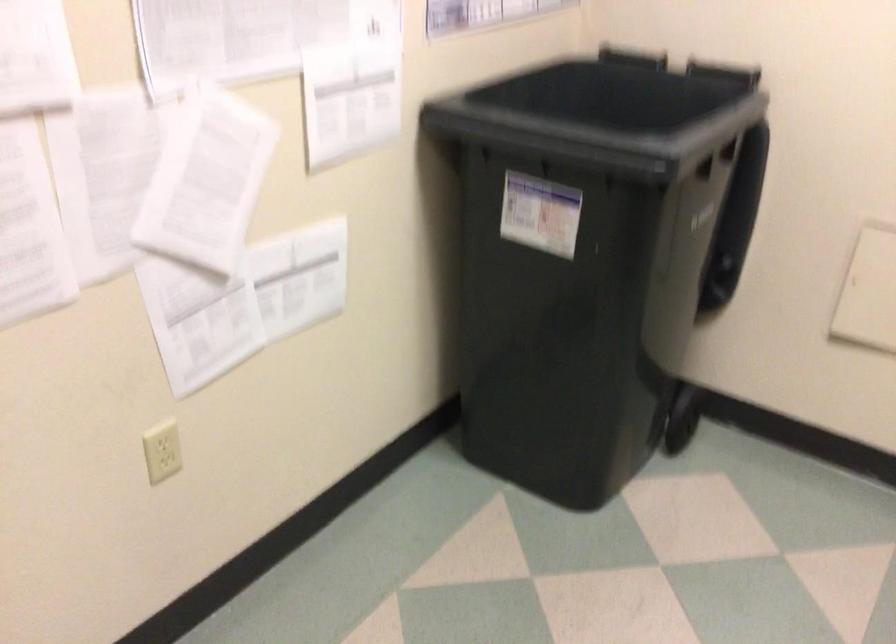
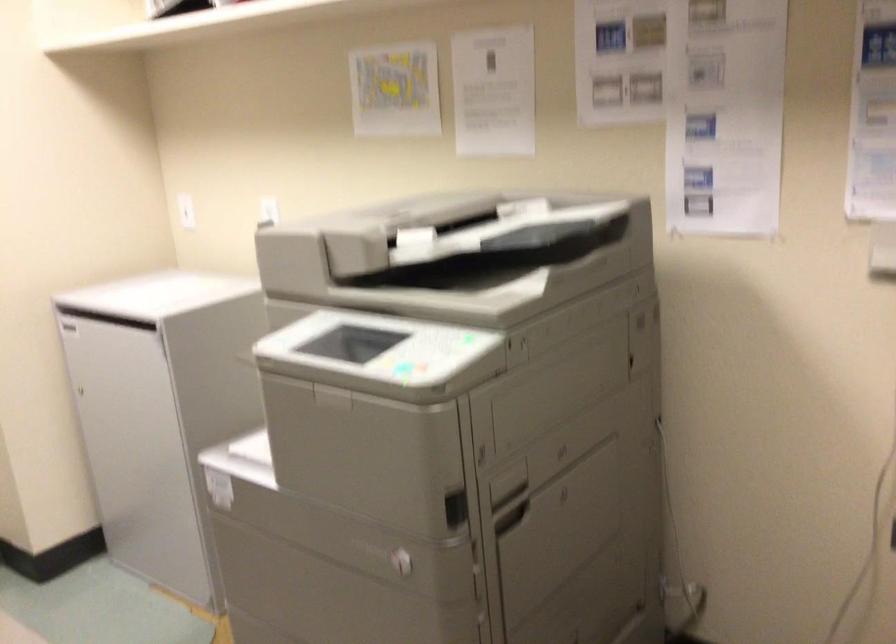
Question: The camera is either moving clockwise (left) or counter-clockwise (right) around the object. The first image is from the beginning of the video and the second image is from the end. Is the camera moving left or right when shooting the video?

Choices:
 (A) Left
 (B) Right

Answer: (A)